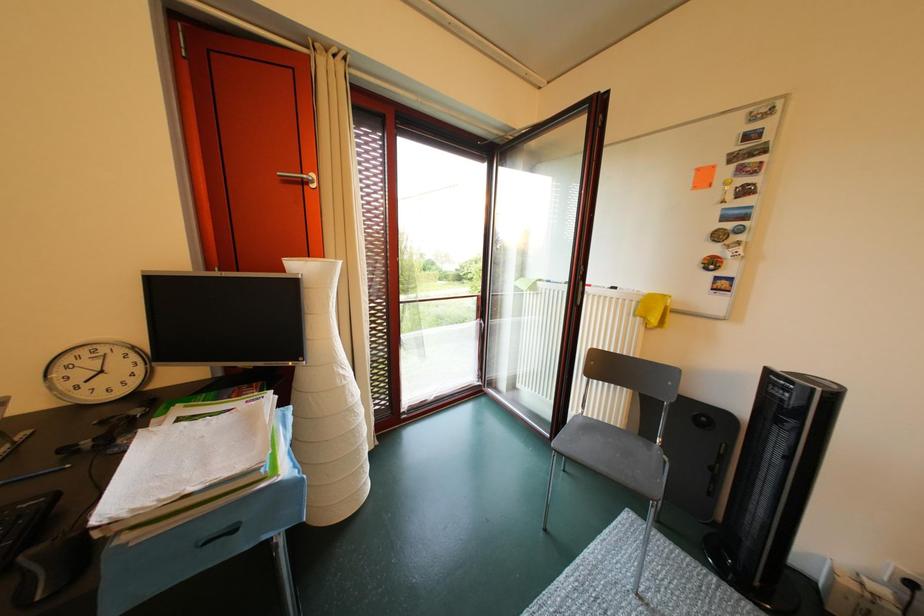
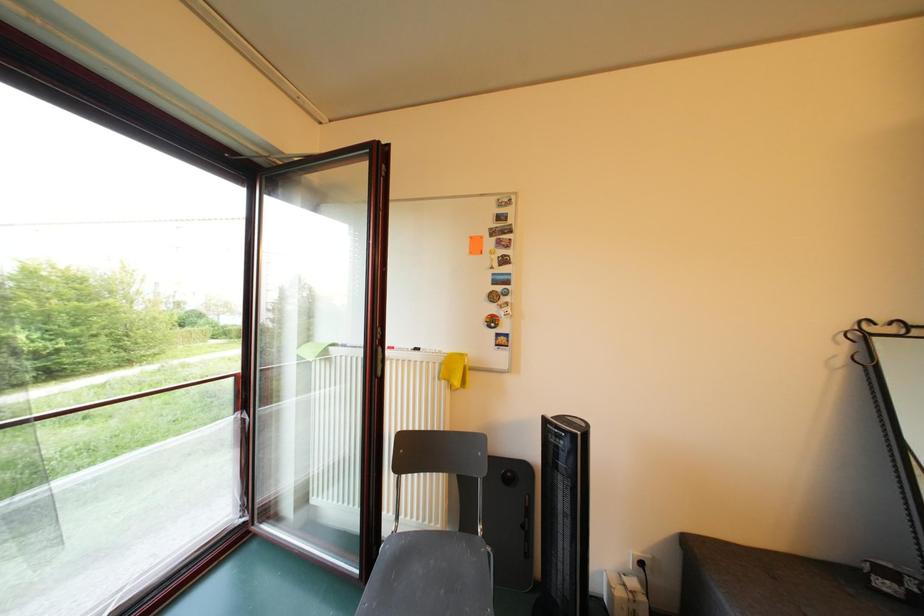
Question: The images are taken continuously from a first-person perspective. In which direction is your viewpoint rotating?

Choices:
 (A) Left
 (B) Right
 (C) Up
 (D) Down

Answer: (B)